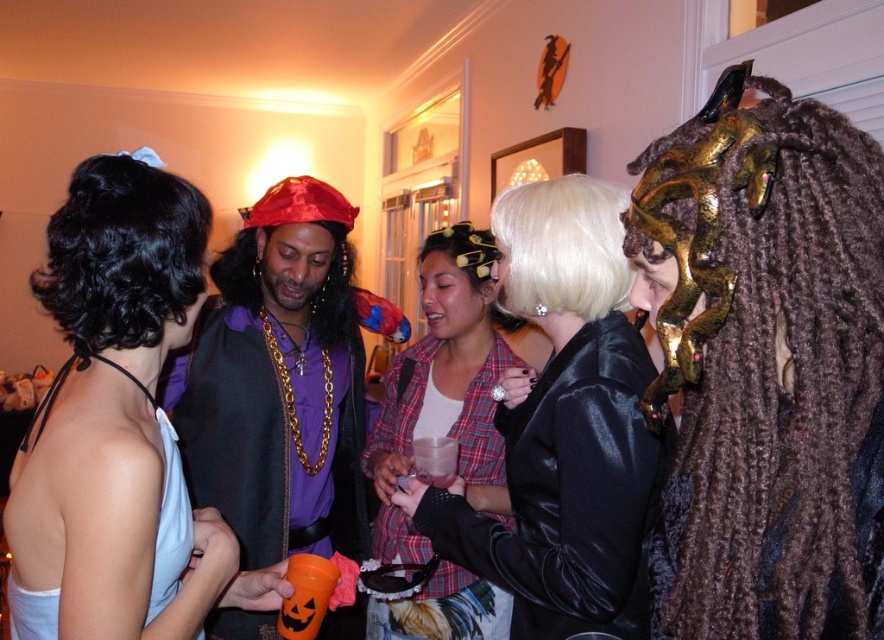
You are at the costume party and want to grab a drink. There is an orange plastic cup at lower left. Where exactly is the orange plastic cup located in the image?

The orange plastic cup at lower left is located at point (159, 488) in the image.

You are a photographer at the party and want to take a photo of both the white satin dress at upper left and the plaid fabric shirt at center. However, you need to ensure that neither of them is blocking the other. Based on their positions, which one should you position closer to the camera to achieve this?

The white satin dress at upper left is already in front of the plaid fabric shirt at center, so positioning the white satin dress at upper left closer to the camera will keep it from blocking the plaid fabric shirt at center.

You are a photographer at the costume party and need to decide which outfit to feature in the magazine spread. Which of the two outfits, the white satin dress at upper left or the plaid fabric shirt at center, would you choose if you want to highlight a more compact and minimalist design?

The white satin dress at upper left has a smaller size compared to plaid fabric shirt at center, so it would be the better choice to highlight a more compact and minimalist design.